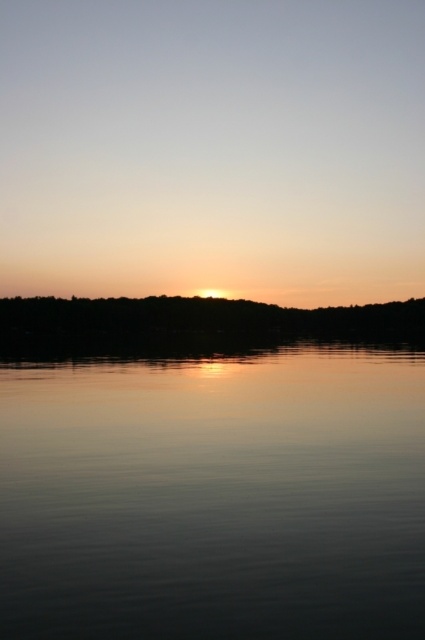
Which is below, smooth water at center or golden reflective sky at center?

smooth water at center is lower down.

Who is higher up, smooth water at center or golden reflective sky at center?

golden reflective sky at center is higher up.

Is point (204, 388) closer to viewer compared to point (348, 312)?

Yes, it is in front of point (348, 312).

This screenshot has width=425, height=640. I want to click on smooth water at center, so click(x=214, y=496).